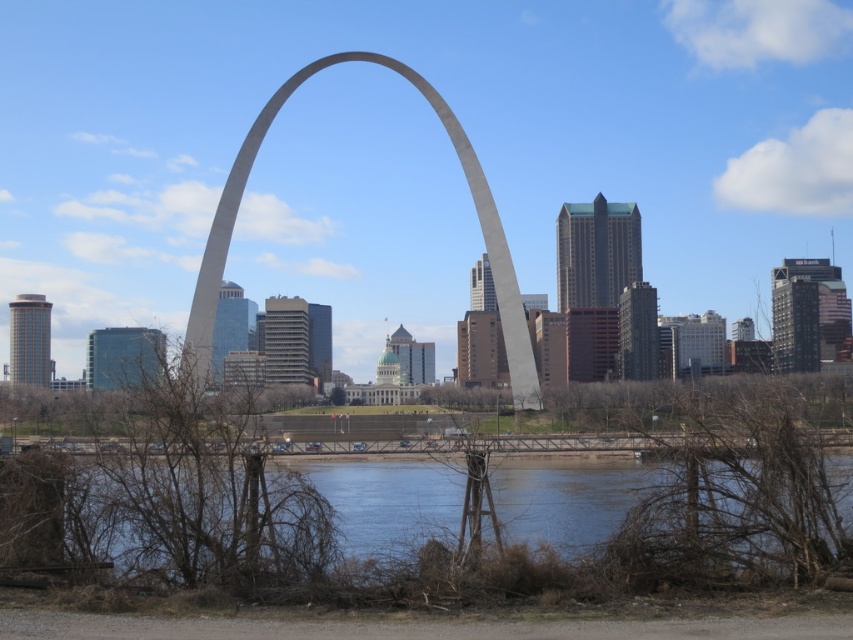
You are a photographer planning to capture the Gateway Arch and the river in one shot. Given that the clear water at lower center occupies less space than the gray concrete arch at center, which object should you focus on to ensure both are visible without cropping?

Since the clear water at lower center occupies less space than the gray concrete arch at center, you should focus on the gray concrete arch at center to ensure both objects are visible in the frame without cropping.

You are standing on the riverbank and see the clear water at lower center and the gray concrete arch at center. Which object is closer to your current position?

The clear water at lower center is closer to your current position because it is located below the gray concrete arch at center.